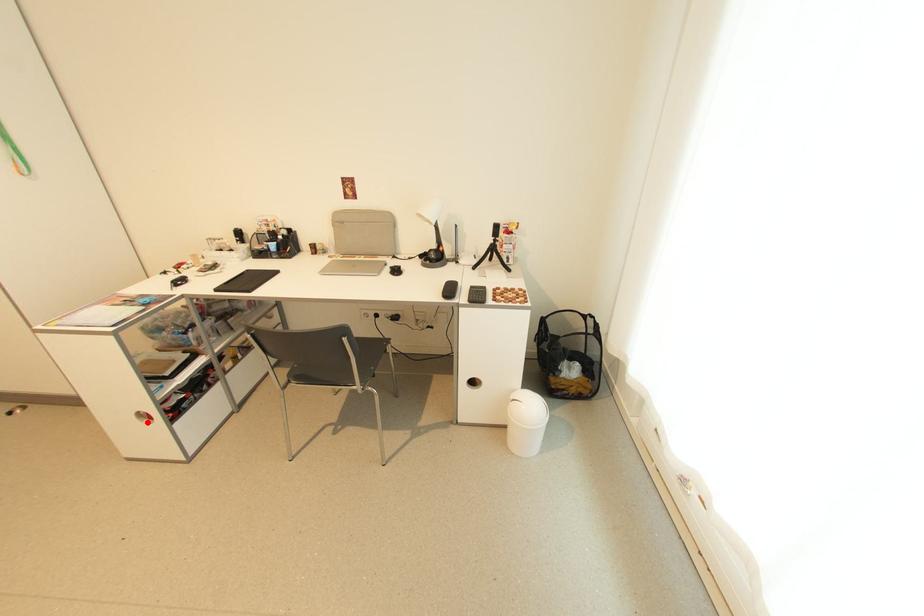
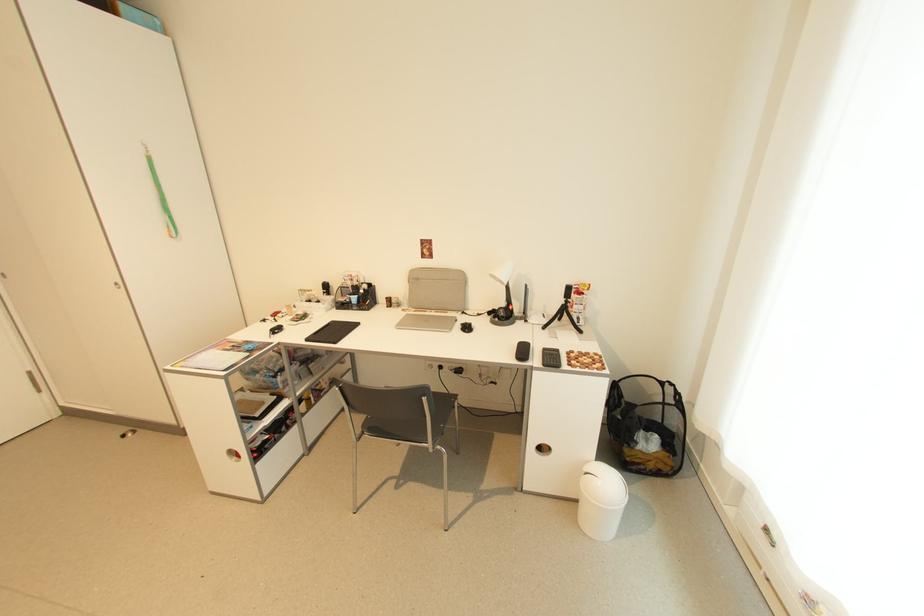
Question: I am providing you with two images of the same scene from different viewpoints. A red point is shown in image1. For the corresponding object point in image2, is it positioned nearer or farther from the camera?

Choices:
 (A) Nearer
 (B) Farther

Answer: (B)